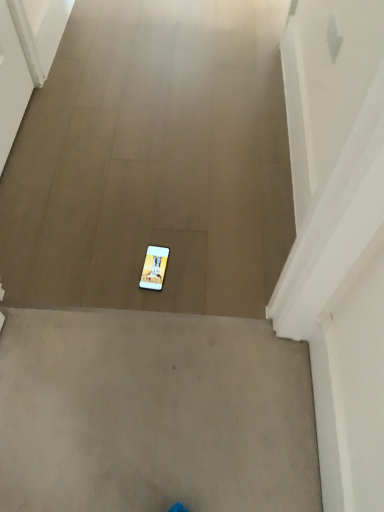
Where is `white glossy mobile phone at center`? The height and width of the screenshot is (512, 384). white glossy mobile phone at center is located at coordinates (154, 268).

What is the approximate height of white glossy mobile phone at center?

It is 0.39 inches.

What do you see at coordinates (154, 268) in the screenshot? This screenshot has height=512, width=384. I see `white glossy mobile phone at center` at bounding box center [154, 268].

Measure the distance between point (274, 101) and camera.

The depth of point (274, 101) is 5.85 feet.

This screenshot has height=512, width=384. What do you see at coordinates (153, 161) in the screenshot? I see `white matte phone at center` at bounding box center [153, 161].

Measure the distance between white matte phone at center and camera.

white matte phone at center and camera are 1.29 meters apart.

Where is `white matte phone at center`? The height and width of the screenshot is (512, 384). white matte phone at center is located at coordinates (153, 161).

The image size is (384, 512). In order to click on white glossy mobile phone at center in this screenshot , I will do `click(154, 268)`.

Which is more to the left, white glossy mobile phone at center or white matte phone at center?

white matte phone at center is more to the left.

Is white glossy mobile phone at center positioned in front of white matte phone at center?

No, white glossy mobile phone at center is further to the viewer.

Is point (162, 256) closer or farther from the camera than point (204, 293)?

Clearly, point (162, 256) is more distant from the camera than point (204, 293).

From the image's perspective, between white glossy mobile phone at center and white matte phone at center, who is located below?

white glossy mobile phone at center appears lower in the image.

From the picture: From a real-world perspective, between white glossy mobile phone at center and white matte phone at center, who is vertically lower?

From a 3D spatial view, white glossy mobile phone at center is below.

Considering the relative sizes of white glossy mobile phone at center and white matte phone at center in the image provided, is white glossy mobile phone at center thinner than white matte phone at center?

Indeed, white glossy mobile phone at center has a lesser width compared to white matte phone at center.

Which of these two, white glossy mobile phone at center or white matte phone at center, stands taller?

white matte phone at center.

Considering the relative sizes of white glossy mobile phone at center and white matte phone at center in the image provided, is white glossy mobile phone at center smaller than white matte phone at center?

Yes.

Is white glossy mobile phone at center not inside white matte phone at center?

Actually, white glossy mobile phone at center is within white matte phone at center.

Is white glossy mobile phone at center touching white matte phone at center?

No, white glossy mobile phone at center is not with white matte phone at center.

Does white glossy mobile phone at center turn towards white matte phone at center?

Yes.

Consider the image. How many degrees apart are the facing directions of white glossy mobile phone at center and white matte phone at center?

The facing directions of white glossy mobile phone at center and white matte phone at center are 176 degrees apart.

Measure the distance between white glossy mobile phone at center and white matte phone at center.

white glossy mobile phone at center is 19.10 inches away from white matte phone at center.

Locate an element on the screen. concrete above the white glossy mobile phone at center (from the image's perspective) is located at coordinates (153, 161).

Which object is positioned more to the left, white matte phone at center or white glossy mobile phone at center?

Positioned to the left is white matte phone at center.

Is white matte phone at center closer to camera compared to white glossy mobile phone at center?

Yes.

Does point (120, 16) come behind point (144, 270)?

Yes, point (120, 16) is farther from viewer.

From the image's perspective, which object appears higher, white matte phone at center or white glossy mobile phone at center?

white matte phone at center is shown above in the image.

In the scene shown: From a real-world perspective, between white matte phone at center and white glossy mobile phone at center, who is vertically lower?

white glossy mobile phone at center.

Is white matte phone at center thinner than white glossy mobile phone at center?

Incorrect, the width of white matte phone at center is not less than that of white glossy mobile phone at center.

From their relative heights in the image, would you say white matte phone at center is taller or shorter than white glossy mobile phone at center?

Considering their sizes, white matte phone at center has more height than white glossy mobile phone at center.

Considering the relative sizes of white matte phone at center and white glossy mobile phone at center in the image provided, is white matte phone at center smaller than white glossy mobile phone at center?

No, white matte phone at center is not smaller than white glossy mobile phone at center.

Can we say white matte phone at center lies outside white glossy mobile phone at center?

Yes, white matte phone at center is not within white glossy mobile phone at center.

Is white matte phone at center positioned far away from white glossy mobile phone at center?

That's not correct — white matte phone at center is a little close to white glossy mobile phone at center.

Is white matte phone at center turned away from white glossy mobile phone at center?

No, white glossy mobile phone at center is not at the back of white matte phone at center.

How different are the orientations of white matte phone at center and white glossy mobile phone at center in degrees?

There is a 176-degree angle between the facing directions of white matte phone at center and white glossy mobile phone at center.

The height and width of the screenshot is (512, 384). I want to click on concrete lying on the left of white glossy mobile phone at center, so click(153, 161).

I want to click on mobile phone that is on the right side of white matte phone at center, so click(154, 268).

Find the location of a particular element. The image size is (384, 512). concrete that is above the white glossy mobile phone at center (from the image's perspective) is located at coordinates (153, 161).